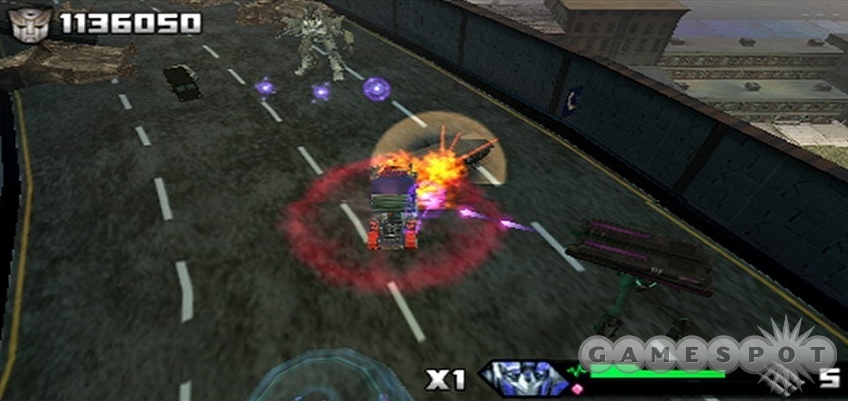
Where is `round purple light`? round purple light is located at coordinates (382, 87), (325, 91), (268, 88).